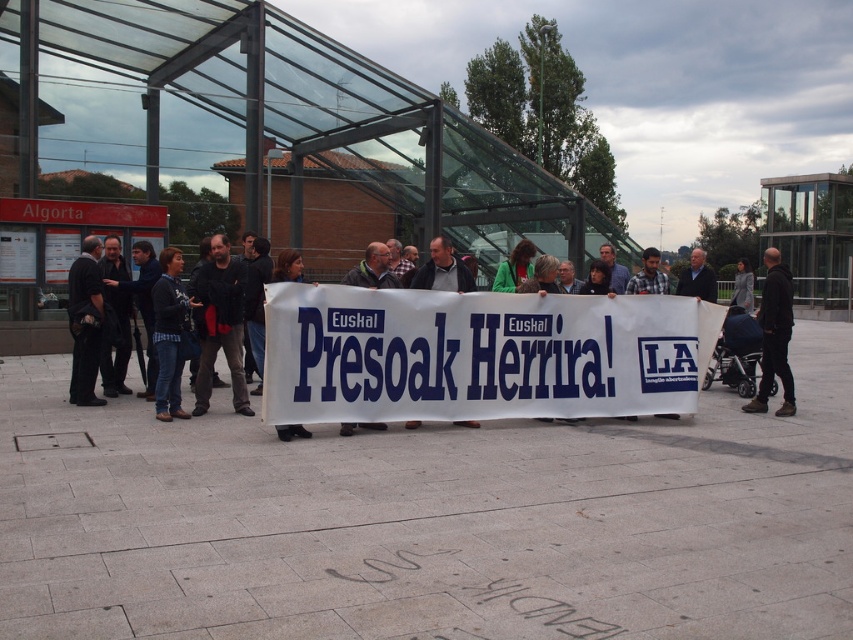
Question: Considering the relative positions of white fabric banner at center and matte black banner at center in the image provided, where is white fabric banner at center located with respect to matte black banner at center?

Choices:
 (A) left
 (B) right

Answer: (B)

Question: Which point appears closest to the camera in this image?

Choices:
 (A) (288, 320)
 (B) (241, 406)

Answer: (A)

Question: Is black shirt at left bigger than black leather jacket at center?

Choices:
 (A) no
 (B) yes

Answer: (B)

Question: Which point is closer to the camera taking this photo?

Choices:
 (A) (741, 275)
 (B) (306, 374)
 (C) (434, 264)
 (D) (172, 269)

Answer: (B)

Question: Which object is farther from the camera taking this photo?

Choices:
 (A) dark gray sweater at center
 (B) gray wool coat at center
 (C) blue denim jeans at center
 (D) black shirt at left

Answer: (B)

Question: Can you confirm if white fabric banner at center is smaller than dark gray sweater at center?

Choices:
 (A) no
 (B) yes

Answer: (A)